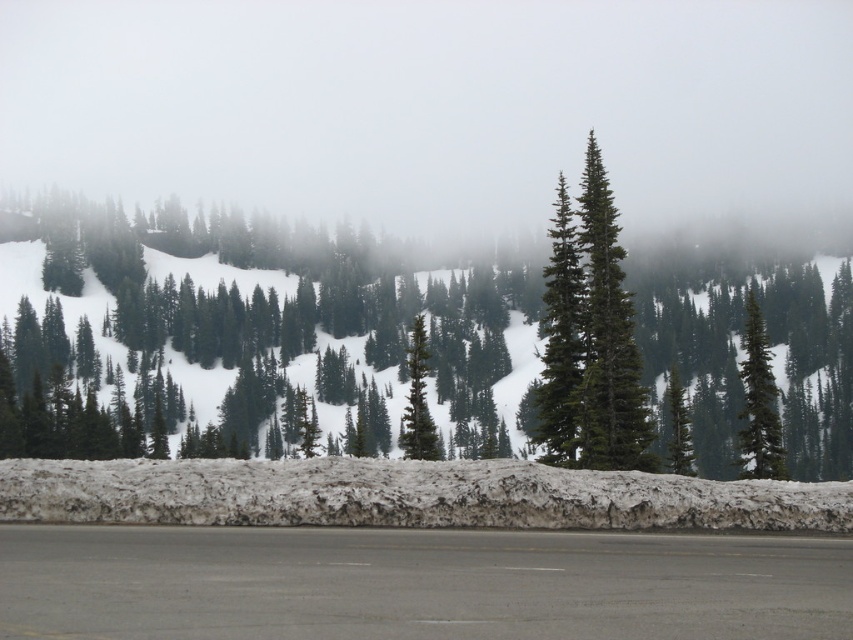
Question: Estimate the real-world distances between objects in this image. Which object is farther from the green matte tree at center-right?

Choices:
 (A) gray asphalt highway at lower center
 (B) green matte tree at center

Answer: (A)

Question: Does green matte evergreen tree at center have a smaller size compared to green matte tree at center?

Choices:
 (A) no
 (B) yes

Answer: (A)

Question: From the image, what is the correct spatial relationship of green matte tree at center-right in relation to green matte tree at center?

Choices:
 (A) below
 (B) above

Answer: (B)

Question: Does gray asphalt highway at lower center appear over green matte tree at center?

Choices:
 (A) no
 (B) yes

Answer: (B)

Question: Which of the following is the farthest from the observer?

Choices:
 (A) green matte tree at center
 (B) gray asphalt highway at lower center
 (C) green matte evergreen tree at center
 (D) green matte tree at center-right

Answer: (D)

Question: Which point is farther to the camera?

Choices:
 (A) green matte evergreen tree at center
 (B) gray asphalt highway at lower center
 (C) green matte tree at center-right

Answer: (C)